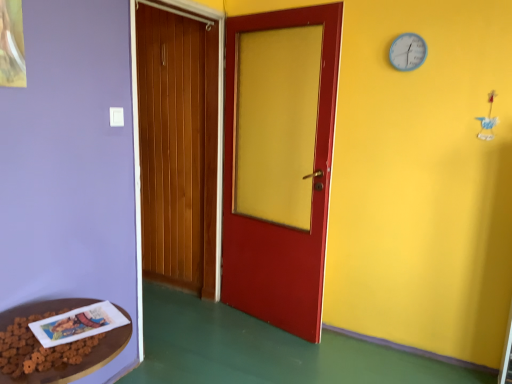
Question: From the image's perspective, does blue plastic clock at upper right appear lower than brown wooden table at lower left?

Choices:
 (A) no
 (B) yes

Answer: (A)

Question: Is blue plastic clock at upper right facing away from brown wooden table at lower left?

Choices:
 (A) no
 (B) yes

Answer: (A)

Question: Does blue plastic clock at upper right have a smaller size compared to brown wooden table at lower left?

Choices:
 (A) no
 (B) yes

Answer: (B)

Question: Is blue plastic clock at upper right far away from brown wooden table at lower left?

Choices:
 (A) yes
 (B) no

Answer: (A)

Question: Can you confirm if blue plastic clock at upper right is thinner than brown wooden table at lower left?

Choices:
 (A) no
 (B) yes

Answer: (B)

Question: Relative to white paper book at lower left, is blue plastic clock at upper right in front or behind?

Choices:
 (A) behind
 (B) front

Answer: (A)

Question: Considering the positions of point (402, 59) and point (80, 327), is point (402, 59) closer or farther from the camera than point (80, 327)?

Choices:
 (A) closer
 (B) farther

Answer: (B)

Question: From a real-world perspective, is blue plastic clock at upper right physically located above or below white paper book at lower left?

Choices:
 (A) above
 (B) below

Answer: (A)

Question: Looking at their shapes, would you say blue plastic clock at upper right is wider or thinner than white paper book at lower left?

Choices:
 (A) thin
 (B) wide

Answer: (A)

Question: From a real-world perspective, is brown wooden table at lower left positioned above or below white paper book at lower left?

Choices:
 (A) below
 (B) above

Answer: (B)

Question: Choose the correct answer: Is brown wooden table at lower left inside white paper book at lower left or outside it?

Choices:
 (A) inside
 (B) outside

Answer: (B)

Question: Is brown wooden table at lower left bigger or smaller than white paper book at lower left?

Choices:
 (A) small
 (B) big

Answer: (B)

Question: Is point tap(91, 370) positioned closer to the camera than point tap(56, 314)?

Choices:
 (A) farther
 (B) closer

Answer: (A)

Question: From the image's perspective, is brown wooden table at lower left located above or below blue plastic clock at upper right?

Choices:
 (A) below
 (B) above

Answer: (A)

Question: Is brown wooden table at lower left inside the boundaries of blue plastic clock at upper right, or outside?

Choices:
 (A) inside
 (B) outside

Answer: (B)